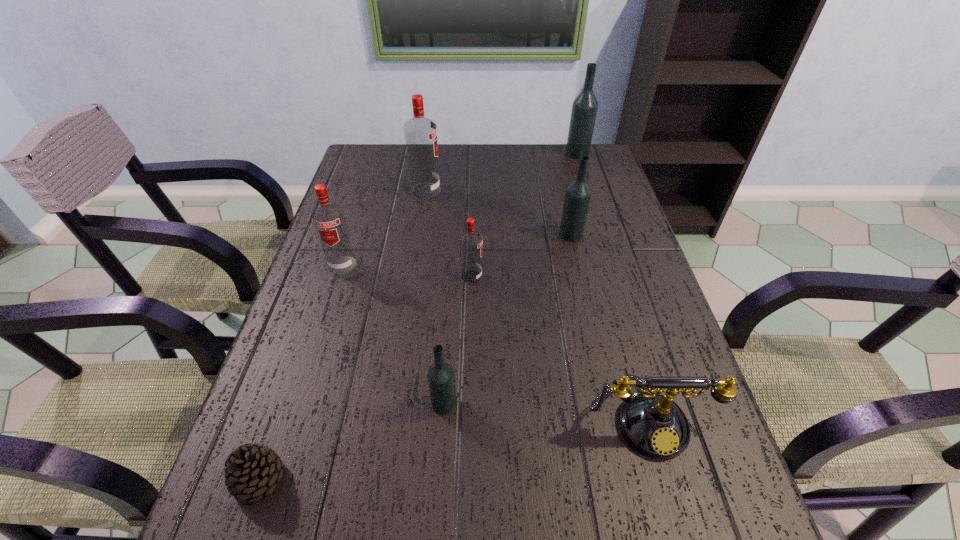
Identify the location of free area in between the rightmost red vodka and the black telephone. (x=559, y=347).

Locate which object ranks third in proximity to the third object from left to right. Please provide its 2D coordinates. Your answer should be formatted as a tuple, i.e. [(x, y)], where the tuple contains the x and y coordinates of a point satisfying the conditions above.

[(577, 197)]

Locate which object is the fifth closest to the leftmost vodka. Please provide its 2D coordinates. Your answer should be formatted as a tuple, i.e. [(x, y)], where the tuple contains the x and y coordinates of a point satisfying the conditions above.

[(577, 197)]

Where is `the closest vodka to the pinecone`? Image resolution: width=960 pixels, height=540 pixels. the closest vodka to the pinecone is located at coordinates (x=441, y=380).

Locate which vodka ranks fifth in proximity to the pinecone. Please provide its 2D coordinates. Your answer should be formatted as a tuple, i.e. [(x, y)], where the tuple contains the x and y coordinates of a point satisfying the conditions above.

[(577, 197)]

Identify which black vodka is the third closest to the leftmost red vodka. Please provide its 2D coordinates. Your answer should be formatted as a tuple, i.e. [(x, y)], where the tuple contains the x and y coordinates of a point satisfying the conditions above.

[(584, 109)]

Identify the location of the second closest black vodka relative to the rightmost red vodka. click(441, 380).

Identify the location of red vodka that is the second closest to the black telephone. (329, 220).

Image resolution: width=960 pixels, height=540 pixels. Find the location of `red vodka identified as the second closest to the leftmost vodka`. red vodka identified as the second closest to the leftmost vodka is located at coordinates (420, 133).

In order to click on free region that satisfies the following two spatial constraints: 1. on the front label of the leftmost red vodka; 2. at the narrow end of the shortest object in this screenshot , I will do `click(275, 478)`.